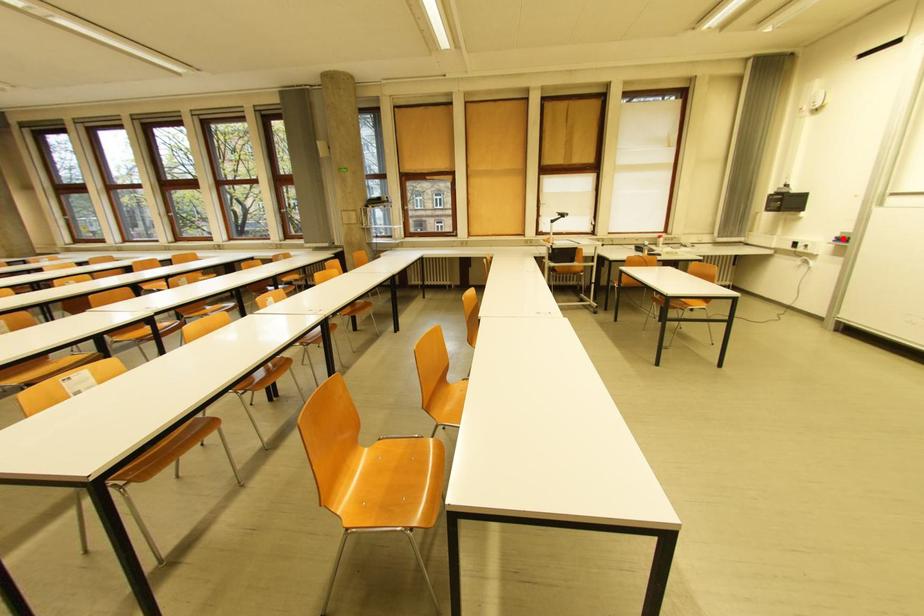
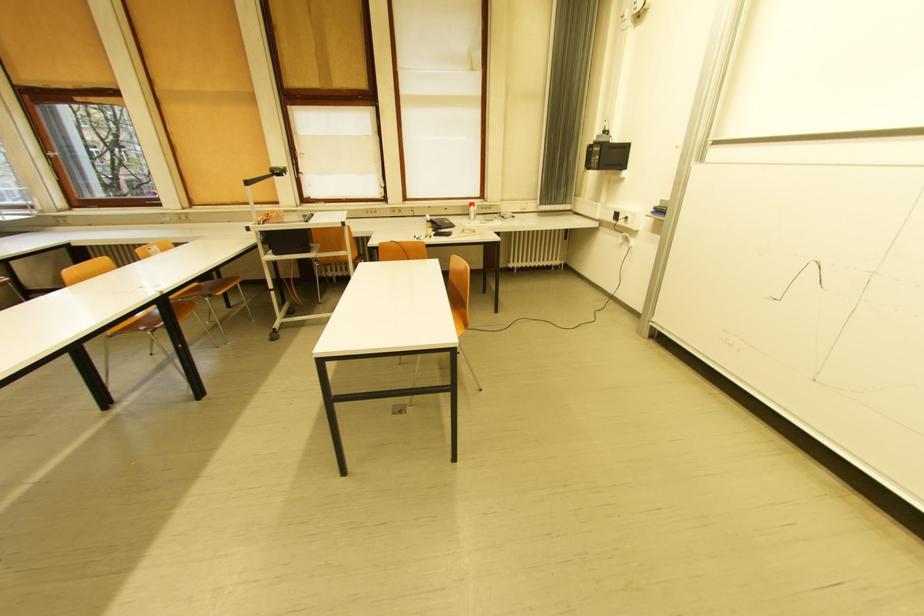
In the second image, find the point that corresponds to the highlighted location in the first image.

(662, 209)